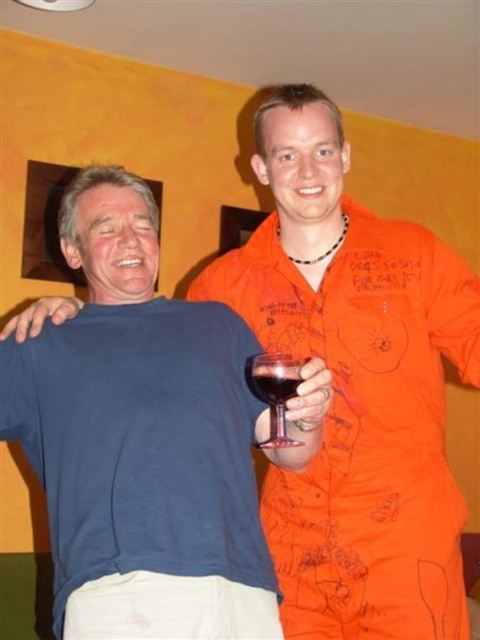
You are a photographer setting up for a portrait. You need to focus on the transparent glass at right which is 3.43 feet away. Can you adjust your camera to focus on it without blurring the person on the left who is farther away?

The transparent glass at right is 3.43 feet from camera. Since the person on the left is farther away, adjusting the focus to the transparent glass at right may cause the person on the left to be out of focus. Use a smaller aperture for a deeper depth of field to keep both in focus.

You are standing in the room and want to place a new picture frame exactly at the same position as the transparent glass at right. What coordinates should you use?

You should place the new picture frame at coordinates (275, 392), which is the 2D location of the transparent glass at right.